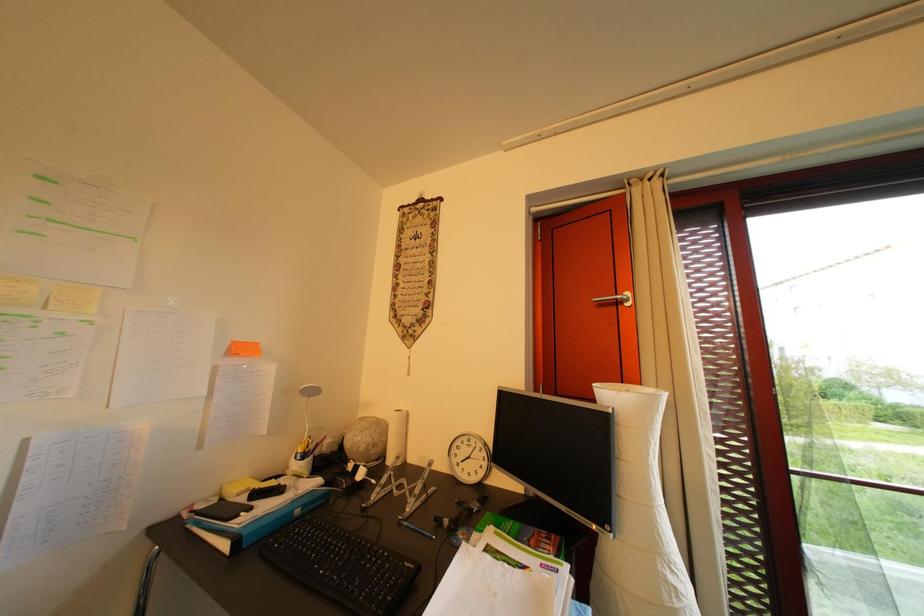
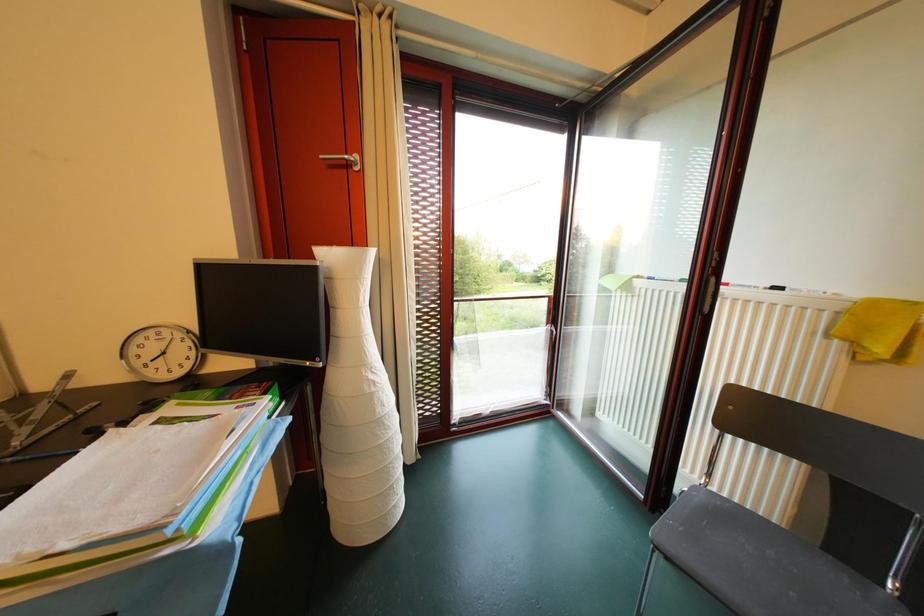
The images are taken continuously from a first-person perspective. In which direction is your viewpoint rotating?

The rotation direction of the camera is right-down.